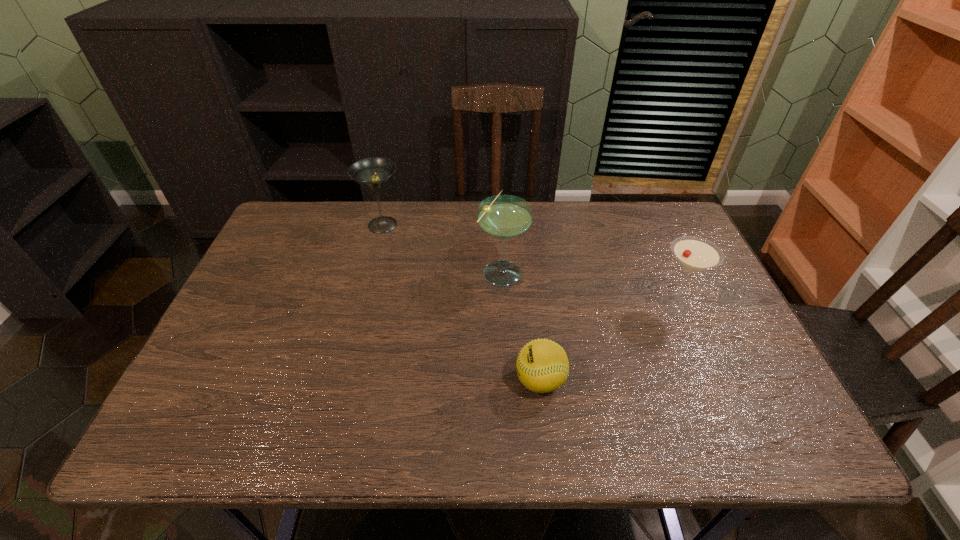
Locate an element on the screen. unoccupied area between the leftmost object and the rightmost object is located at coordinates (528, 265).

The image size is (960, 540). Identify the location of the second closest object to the shortest martini. (504, 217).

Identify which object is the second closest to the second martini from right to left. Please provide its 2D coordinates. Your answer should be formatted as a tuple, i.e. [(x, y)], where the tuple contains the x and y coordinates of a point satisfying the conditions above.

[(373, 173)]

Find the location of a particular element. martini that is the closest one to the nearest object is located at coordinates (504, 217).

Identify which martini is the second closest to the farthest object. Please provide its 2D coordinates. Your answer should be formatted as a tuple, i.e. [(x, y)], where the tuple contains the x and y coordinates of a point satisfying the conditions above.

[(694, 254)]

I want to click on vacant space that satisfies the following two spatial constraints: 1. on the front side of the second martini from left to right; 2. on the left side of the farthest martini, so click(371, 271).